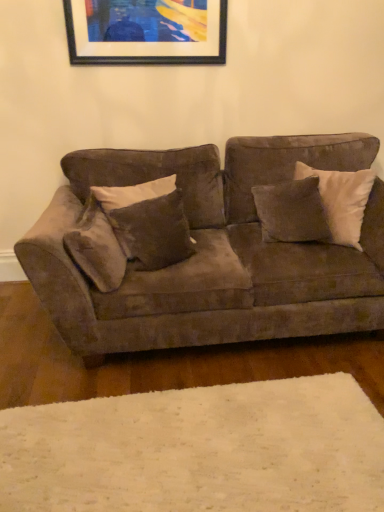
Describe the element at coordinates (199, 450) in the screenshot. I see `white soft rug at lower center` at that location.

You are a GUI agent. You are given a task and a screenshot of the screen. Output one action in this format:
    pyautogui.click(x=<x>, y=<y>)
    Task: Click on the suede couch at center
    This screenshot has width=384, height=512.
    Given the screenshot: What is the action you would take?
    pyautogui.click(x=212, y=253)

At what (x,y) coordinates should I click in order to perform the action: click on velvet brown pillow at center, positioned as the second pillow in right-to-left order. Please return your answer as a coordinate pair (x, y). Looking at the image, I should click on (148, 221).

The image size is (384, 512). What do you see at coordinates (291, 211) in the screenshot? I see `suede-like brown pillow at center, acting as the 3th pillow starting from the left` at bounding box center [291, 211].

Looking at this image, measure the distance between suede-like brown pillow at left, positioned as the first pillow in left-to-right order, and camera.

1.83 meters.

Locate an element on the screen. The image size is (384, 512). white soft rug at lower center is located at coordinates (199, 450).

Image resolution: width=384 pixels, height=512 pixels. I want to click on plain below the black matte picture frame at upper center (from the image's perspective), so click(199, 450).

Is point (246, 451) positioned behind point (107, 36)?

No.

From a real-world perspective, is white soft rug at lower center under black matte picture frame at upper center?

Correct, in the physical world, white soft rug at lower center is lower than black matte picture frame at upper center.

Can you tell me how much suede couch at center and suede-like brown pillow at center, acting as the 3th pillow starting from the left, differ in facing direction?

suede couch at center and suede-like brown pillow at center, acting as the 3th pillow starting from the left, are facing 34.3 degrees away from each other.

Considering the sizes of objects suede couch at center and suede-like brown pillow at center, acting as the 3th pillow starting from the left, in the image provided, who is taller, suede couch at center or suede-like brown pillow at center, acting as the 3th pillow starting from the left,?

suede couch at center is taller.

Based on their sizes in the image, would you say suede couch at center is bigger or smaller than suede-like brown pillow at center, arranged as the first pillow when viewed from the right?

Considering their sizes, suede couch at center takes up more space than suede-like brown pillow at center, arranged as the first pillow when viewed from the right.

Based on the photo, could you tell me if suede couch at center is facing suede-like brown pillow at center, acting as the 3th pillow starting from the left?

Yes, suede couch at center is oriented towards suede-like brown pillow at center, acting as the 3th pillow starting from the left.

From a real-world perspective, is suede-like brown pillow at left, positioned as the first pillow in left-to-right order, located beneath velvet brown pillow at center, positioned as the second pillow in right-to-left order?

Correct, in the physical world, suede-like brown pillow at left, positioned as the first pillow in left-to-right order, is lower than velvet brown pillow at center, positioned as the second pillow in right-to-left order.

Which object is positioned more to the left, suede-like brown pillow at left, the third pillow in the right-to-left sequence, or velvet brown pillow at center, which is the 2th pillow in left-to-right order?

suede-like brown pillow at left, the third pillow in the right-to-left sequence, is more to the left.

Considering the sizes of suede-like brown pillow at left, positioned as the first pillow in left-to-right order, and velvet brown pillow at center, positioned as the second pillow in right-to-left order, in the image, is suede-like brown pillow at left, positioned as the first pillow in left-to-right order, wider or thinner than velvet brown pillow at center, positioned as the second pillow in right-to-left order,?

Considering their sizes, suede-like brown pillow at left, positioned as the first pillow in left-to-right order, looks slimmer than velvet brown pillow at center, positioned as the second pillow in right-to-left order.

Is suede-like brown pillow at left, the third pillow in the right-to-left sequence, positioned in front of velvet brown pillow at center, positioned as the second pillow in right-to-left order?

Yes, it is in front of velvet brown pillow at center, positioned as the second pillow in right-to-left order.

Can you confirm if suede couch at center is bigger than velvet brown pillow at center, which is the 2th pillow in left-to-right order?

Indeed, suede couch at center has a larger size compared to velvet brown pillow at center, which is the 2th pillow in left-to-right order.

From the image's perspective, is suede couch at center located beneath velvet brown pillow at center, which is the 2th pillow in left-to-right order?

Indeed, from the image's perspective, suede couch at center is shown beneath velvet brown pillow at center, which is the 2th pillow in left-to-right order.

Does point (360, 150) appear closer or farther from the camera than point (146, 184)?

Clearly, point (360, 150) is more distant from the camera than point (146, 184).

From a real-world perspective, between suede couch at center and velvet brown pillow at center, positioned as the second pillow in right-to-left order, who is vertically higher?

From a 3D spatial view, velvet brown pillow at center, positioned as the second pillow in right-to-left order, is above.

Measure the distance from suede-like brown pillow at center, acting as the 3th pillow starting from the left, to suede-like brown pillow at left, positioned as the first pillow in left-to-right order.

suede-like brown pillow at center, acting as the 3th pillow starting from the left, is 93.53 centimeters from suede-like brown pillow at left, positioned as the first pillow in left-to-right order.

Based on the photo, in the image, is suede-like brown pillow at center, acting as the 3th pillow starting from the left, on the left side or the right side of suede-like brown pillow at left, positioned as the first pillow in left-to-right order?

Based on their positions, suede-like brown pillow at center, acting as the 3th pillow starting from the left, is located to the right of suede-like brown pillow at left, positioned as the first pillow in left-to-right order.

Is suede-like brown pillow at center, arranged as the first pillow when viewed from the right, smaller than suede-like brown pillow at left, positioned as the first pillow in left-to-right order?

Yes, suede-like brown pillow at center, arranged as the first pillow when viewed from the right, is smaller than suede-like brown pillow at left, positioned as the first pillow in left-to-right order.

Could you tell me if suede-like brown pillow at center, acting as the 3th pillow starting from the left, is facing suede-like brown pillow at left, the third pillow in the right-to-left sequence?

No, suede-like brown pillow at center, acting as the 3th pillow starting from the left, is not turned towards suede-like brown pillow at left, the third pillow in the right-to-left sequence.

Is suede-like brown pillow at left, the third pillow in the right-to-left sequence, positioned behind black matte picture frame at upper center?

No.

Looking at this image, is suede-like brown pillow at left, positioned as the first pillow in left-to-right order, not close to black matte picture frame at upper center?

Yes, suede-like brown pillow at left, positioned as the first pillow in left-to-right order, is far from black matte picture frame at upper center.

Which object is further away from the camera, suede couch at center or black matte picture frame at upper center?

black matte picture frame at upper center is further away from the camera.

Does suede couch at center appear on the left side of black matte picture frame at upper center?

A: Incorrect, suede couch at center is not on the left side of black matte picture frame at upper center.

Considering the relative sizes of suede couch at center and black matte picture frame at upper center in the image provided, is suede couch at center taller than black matte picture frame at upper center?

Yes.

I want to click on picture frame positioned vertically above the white soft rug at lower center (from a real-world perspective), so click(x=146, y=32).

Where is `the 3rd pillow behind when counting from the suede couch at center`? The image size is (384, 512). the 3rd pillow behind when counting from the suede couch at center is located at coordinates (291, 211).

Based on their spatial positions, is suede-like brown pillow at left, the third pillow in the right-to-left sequence, or suede-like brown pillow at center, acting as the 3th pillow starting from the left, closer to white soft rug at lower center?

suede-like brown pillow at left, the third pillow in the right-to-left sequence, lies closer to white soft rug at lower center than the other object.

Which object lies further to the anchor point suede-like brown pillow at left, positioned as the first pillow in left-to-right order, white soft rug at lower center or black matte picture frame at upper center?

Based on the image, black matte picture frame at upper center appears to be further to suede-like brown pillow at left, positioned as the first pillow in left-to-right order.

Which object lies nearer to the anchor point black matte picture frame at upper center, suede-like brown pillow at left, positioned as the first pillow in left-to-right order, or white soft rug at lower center?

suede-like brown pillow at left, positioned as the first pillow in left-to-right order.

Estimate the real-world distances between objects in this image. Which object is closer to suede-like brown pillow at center, arranged as the first pillow when viewed from the right, suede-like brown pillow at left, the third pillow in the right-to-left sequence, or black matte picture frame at upper center?

suede-like brown pillow at left, the third pillow in the right-to-left sequence, lies closer to suede-like brown pillow at center, arranged as the first pillow when viewed from the right, than the other object.

When comparing their distances from suede-like brown pillow at center, arranged as the first pillow when viewed from the right, does black matte picture frame at upper center or white soft rug at lower center seem further?

white soft rug at lower center.

Which object lies further to the anchor point velvet brown pillow at center, positioned as the second pillow in right-to-left order, suede-like brown pillow at center, acting as the 3th pillow starting from the left, or white soft rug at lower center?

white soft rug at lower center is further to velvet brown pillow at center, positioned as the second pillow in right-to-left order.

Which object lies further to the anchor point velvet brown pillow at center, positioned as the second pillow in right-to-left order, black matte picture frame at upper center or suede couch at center?

black matte picture frame at upper center is further to velvet brown pillow at center, positioned as the second pillow in right-to-left order.

Looking at the image, which one is located further to suede-like brown pillow at left, positioned as the first pillow in left-to-right order, black matte picture frame at upper center or white soft rug at lower center?

Among the two, black matte picture frame at upper center is located further to suede-like brown pillow at left, positioned as the first pillow in left-to-right order.

In order to click on pillow that lies between suede couch at center and white soft rug at lower center from top to bottom in this screenshot , I will do `click(97, 248)`.

This screenshot has height=512, width=384. I want to click on studio couch between black matte picture frame at upper center and suede-like brown pillow at left, the third pillow in the right-to-left sequence, in the up-down direction, so click(x=212, y=253).

Locate an element on the screen. Image resolution: width=384 pixels, height=512 pixels. pillow situated between suede-like brown pillow at left, the third pillow in the right-to-left sequence, and suede-like brown pillow at center, acting as the 3th pillow starting from the left, from left to right is located at coordinates (148, 221).

Image resolution: width=384 pixels, height=512 pixels. I want to click on pillow between black matte picture frame at upper center and velvet brown pillow at center, which is the 2th pillow in left-to-right order, from top to bottom, so click(x=291, y=211).